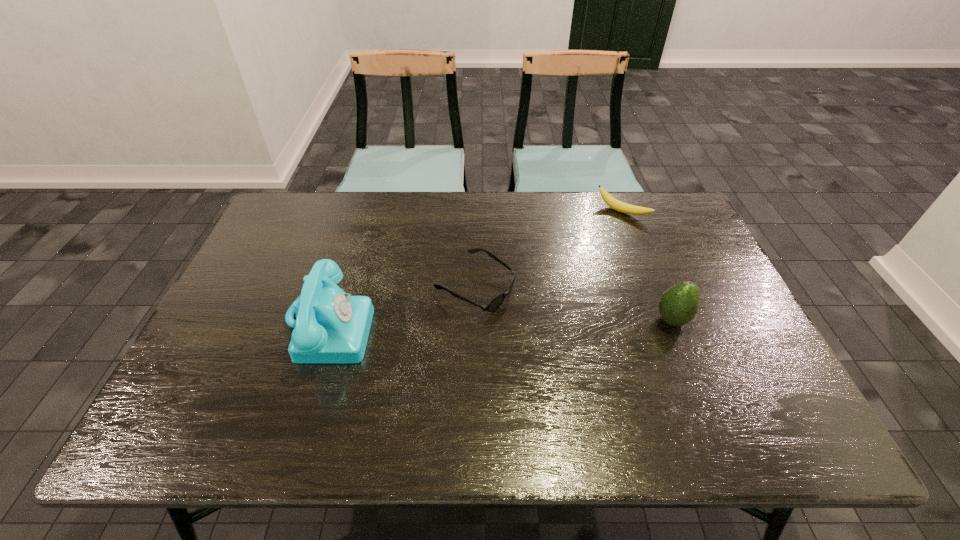
In order to click on the leftmost object in this screenshot , I will do `click(331, 327)`.

The height and width of the screenshot is (540, 960). I want to click on telephone, so click(331, 327).

The height and width of the screenshot is (540, 960). Find the location of `the third shortest object`. the third shortest object is located at coordinates (678, 305).

I want to click on the third object from right to left, so click(x=498, y=300).

You are a GUI agent. You are given a task and a screenshot of the screen. Output one action in this format:
    pyautogui.click(x=<x>, y=<y>)
    Task: Click on the banana
    
    Given the screenshot: What is the action you would take?
    pyautogui.click(x=615, y=204)

The height and width of the screenshot is (540, 960). I want to click on blank space located on the dial of the telephone, so click(496, 325).

I want to click on vacant space located 0.270m on the back of the third shortest object, so click(640, 241).

I want to click on vacant region located 0.270m on the lenses of the third object from right to left, so click(x=607, y=348).

Find the location of a particular element. This screenshot has width=960, height=540. vacant space located on the lenses of the third object from right to left is located at coordinates (565, 329).

Locate an element on the screen. This screenshot has width=960, height=540. vacant space located 0.150m on the lenses of the third object from right to left is located at coordinates (562, 327).